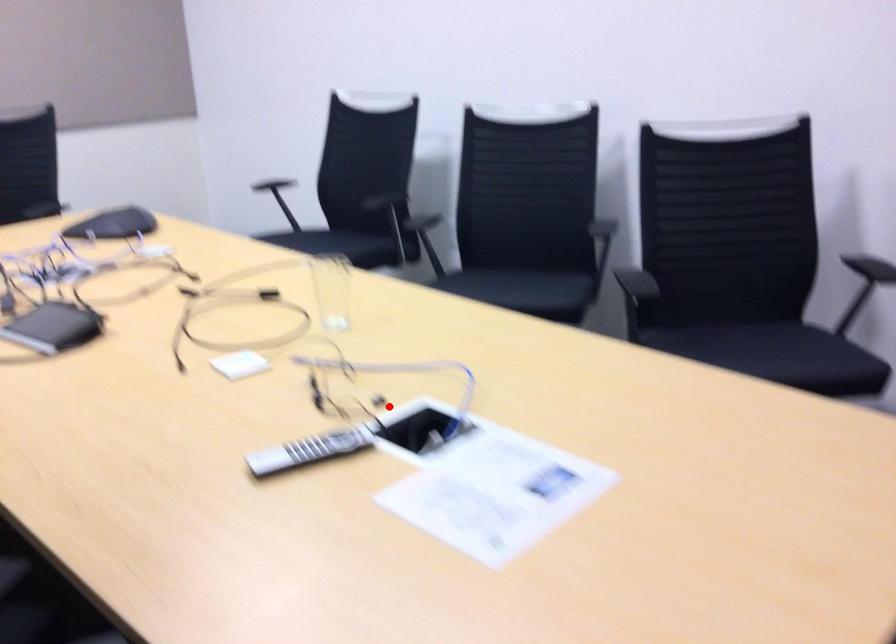
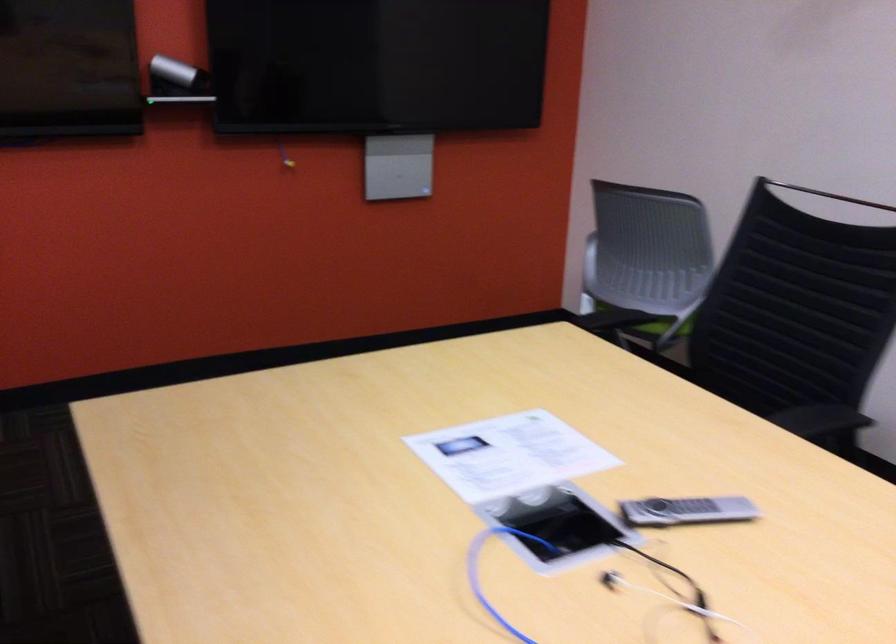
In the second image, find the point that corresponds to the highlighted location in the first image.

(576, 583)